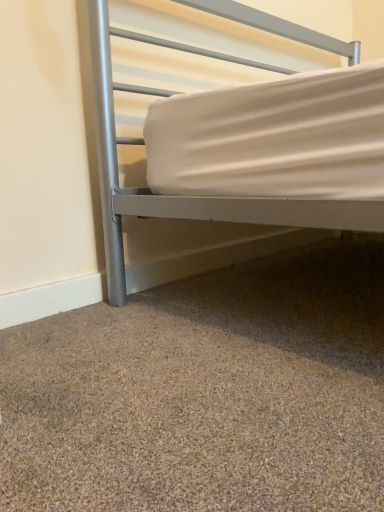
Question: Considering the relative sizes of brown textured carpet at lower center and silver metallic bed at upper center in the image provided, is brown textured carpet at lower center thinner than silver metallic bed at upper center?

Choices:
 (A) yes
 (B) no

Answer: (B)

Question: Is silver metallic bed at upper center inside brown textured carpet at lower center?

Choices:
 (A) yes
 (B) no

Answer: (B)

Question: Is brown textured carpet at lower center aimed at silver metallic bed at upper center?

Choices:
 (A) no
 (B) yes

Answer: (A)

Question: Is brown textured carpet at lower center not near silver metallic bed at upper center?

Choices:
 (A) no
 (B) yes

Answer: (A)

Question: From a real-world perspective, is brown textured carpet at lower center physically below silver metallic bed at upper center?

Choices:
 (A) yes
 (B) no

Answer: (A)

Question: Is brown textured carpet at lower center to the left of silver metallic bed at upper center from the viewer's perspective?

Choices:
 (A) no
 (B) yes

Answer: (B)

Question: Can you confirm if silver metallic bed at upper center is shorter than brown textured carpet at lower center?

Choices:
 (A) no
 (B) yes

Answer: (A)

Question: Is silver metallic bed at upper center positioned in front of brown textured carpet at lower center?

Choices:
 (A) no
 (B) yes

Answer: (A)

Question: From a real-world perspective, is silver metallic bed at upper center located beneath brown textured carpet at lower center?

Choices:
 (A) yes
 (B) no

Answer: (B)

Question: Is silver metallic bed at upper center not near brown textured carpet at lower center?

Choices:
 (A) no
 (B) yes

Answer: (A)

Question: Can you see silver metallic bed at upper center touching brown textured carpet at lower center?

Choices:
 (A) yes
 (B) no

Answer: (B)

Question: Does silver metallic bed at upper center contain brown textured carpet at lower center?

Choices:
 (A) yes
 (B) no

Answer: (B)

Question: From a real-world perspective, is brown textured carpet at lower center positioned above or below silver metallic bed at upper center?

Choices:
 (A) above
 (B) below

Answer: (B)